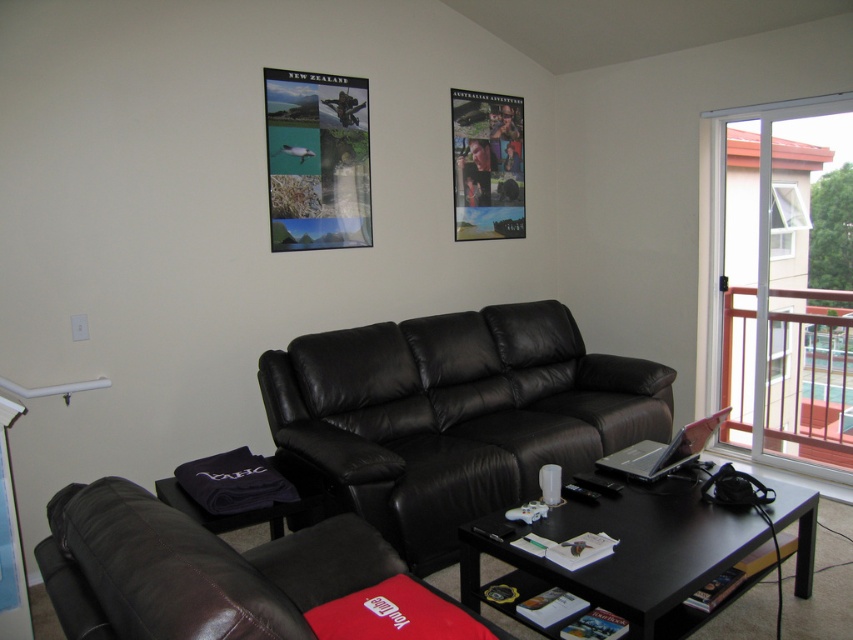
Consider the image. You are standing in the living room and want to pick up an item from the coffee table. There are two points marked on the table surface. Which point is closer to you, point at coordinate [73,509] or point at coordinate [836,392]?

Point at coordinate [73,509] is closer to you than point at coordinate [836,392].

You are a delivery person trying to place a large package that is 5 feet wide in the living room. The package needs to be placed between the white plastic railing at upper right and the metallic poster at upper right. Can the package fit in that space?

The distance between the white plastic railing at upper right and the metallic poster at upper right is 5.50 feet. Since the package is 5 feet wide, it can fit in the space between them as there is enough room.

You are a guest in the living room and want to hang a small picture frame between the white plastic railing at upper right and the metallic poster at upper right. Which object should you place the frame closer to if you want it to be centered between them?

To center the frame between the white plastic railing at upper right and the metallic poster at upper right, you should place it closer to the metallic poster at upper right since the white plastic railing at upper right is wider than the metallic poster at upper right.